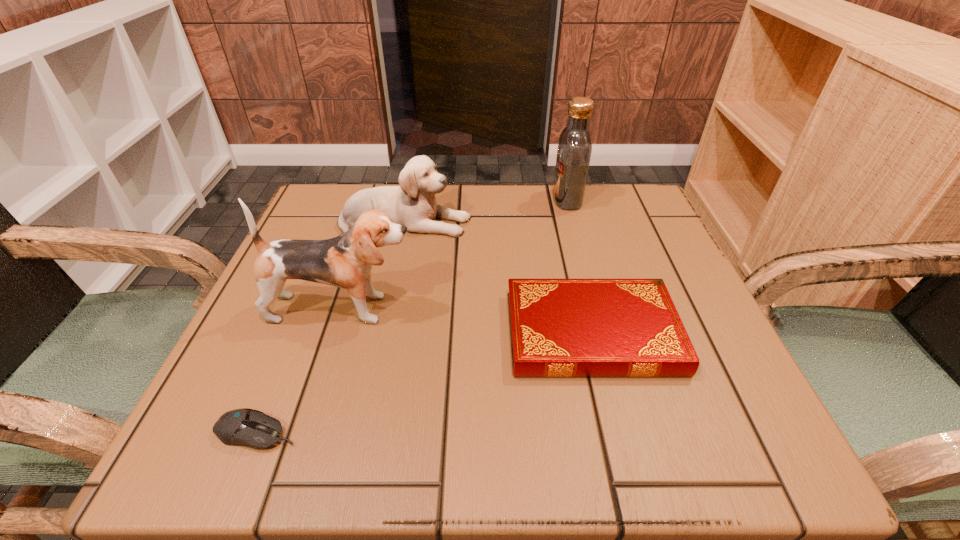
Find the location of a particular element. Image resolution: width=960 pixels, height=540 pixels. blank space at the far right corner is located at coordinates (628, 244).

At what (x,y) coordinates should I click in order to perform the action: click on vacant space at the near right corner of the desktop. Please return your answer as a coordinate pair (x, y). Looking at the image, I should click on (678, 463).

The image size is (960, 540). I want to click on vacant space that's between the hardback book and the farther puppy, so [x=498, y=278].

Locate an element on the screen. vacant space that is in between the second shortest object and the vodka is located at coordinates (580, 266).

Where is `free space between the vodka and the nearer puppy`? Image resolution: width=960 pixels, height=540 pixels. free space between the vodka and the nearer puppy is located at coordinates (455, 254).

At what (x,y) coordinates should I click in order to perform the action: click on unoccupied area between the taller puppy and the vodka. Please return your answer as a coordinate pair (x, y). The image size is (960, 540). Looking at the image, I should click on click(x=455, y=254).

Image resolution: width=960 pixels, height=540 pixels. In order to click on vacant area between the fourth tallest object and the nearer puppy in this screenshot , I will do `click(468, 321)`.

The image size is (960, 540). I want to click on vacant space in between the fourth tallest object and the vodka, so click(x=580, y=266).

Locate an element on the screen. This screenshot has width=960, height=540. free point between the computer mouse and the hardback book is located at coordinates (424, 382).

Identify the location of empty location between the nearer puppy and the nearest object. (300, 370).